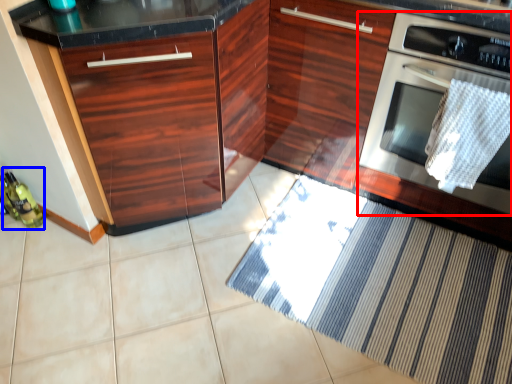
Question: Which of the following is the farthest to the observer, home appliance (highlighted by a red box) or bottle (highlighted by a blue box)?

Choices:
 (A) home appliance
 (B) bottle

Answer: (B)